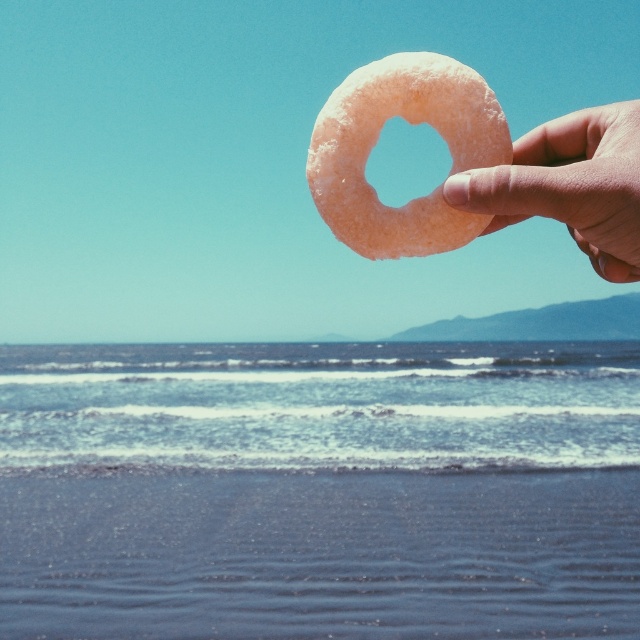
Question: Does sandy beach at lower left have a greater width compared to sugar-coated donut at upper center?

Choices:
 (A) no
 (B) yes

Answer: (B)

Question: Which object appears farthest from the camera in this image?

Choices:
 (A) slightly pinkish matte donut at upper right
 (B) sandy beach at lower left

Answer: (B)

Question: Among these objects, which one is farthest from the camera?

Choices:
 (A) sandy beach at lower left
 (B) slightly pinkish matte donut at upper right
 (C) sugar-coated donut at upper center

Answer: (A)

Question: Which point is farther from the camera taking this photo?

Choices:
 (A) (612, 268)
 (B) (413, 104)

Answer: (B)

Question: Is sandy beach at lower left positioned before slightly pinkish matte donut at upper right?

Choices:
 (A) no
 (B) yes

Answer: (A)

Question: In this image, where is sandy beach at lower left located relative to slightly pinkish matte donut at upper right?

Choices:
 (A) above
 (B) below

Answer: (B)